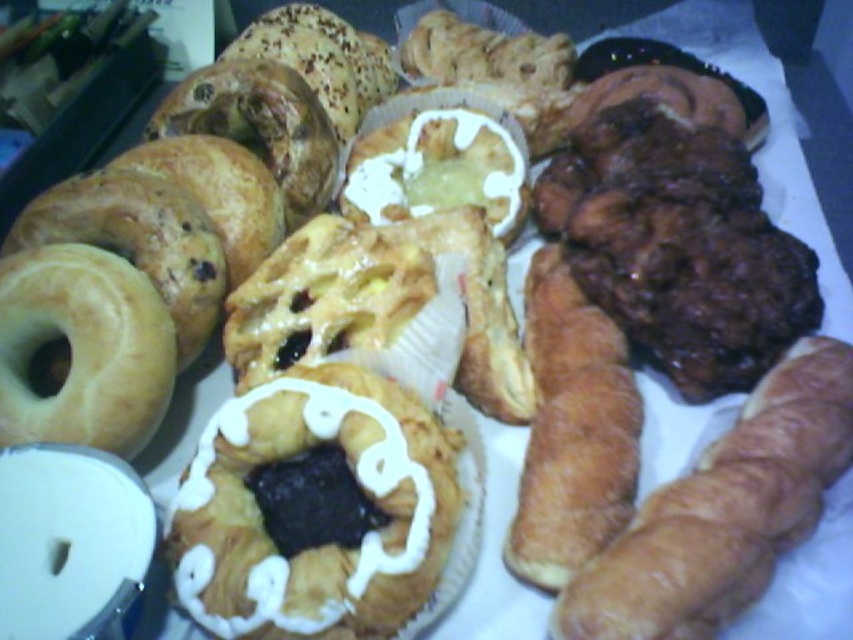
Does golden brown croissant at lower right have a lesser width compared to golden brown flaky croissant at center-right?

Incorrect, golden brown croissant at lower right's width is not less than golden brown flaky croissant at center-right's.

Is golden brown croissant at lower right further to camera compared to golden brown flaky croissant at center-right?

No.

Between point (634, 544) and point (561, 556), which one is positioned in front?

Point (634, 544)

Where is `golden brown croissant at lower right`? golden brown croissant at lower right is located at coordinates (723, 512).

Who is taller, glazed doughnut at center or golden brown flaky croissant at center-right?

With more height is golden brown flaky croissant at center-right.

Does glazed doughnut at center appear on the right side of golden brown flaky croissant at center-right?

In fact, glazed doughnut at center is to the left of golden brown flaky croissant at center-right.

Measure the distance between point (305,445) and camera.

They are 32.55 inches apart.

At what (x,y) coordinates should I click in order to perform the action: click on glazed doughnut at center. Please return your answer as a coordinate pair (x, y). Looking at the image, I should click on (329, 540).

Is point (425, 586) closer to viewer compared to point (28, 280)?

Yes, point (425, 586) is closer to viewer.

Is glazed doughnut at center thinner than golden glazed donut at left?

In fact, glazed doughnut at center might be wider than golden glazed donut at left.

Where is `glazed doughnut at center`? The image size is (853, 640). glazed doughnut at center is located at coordinates point(329,540).